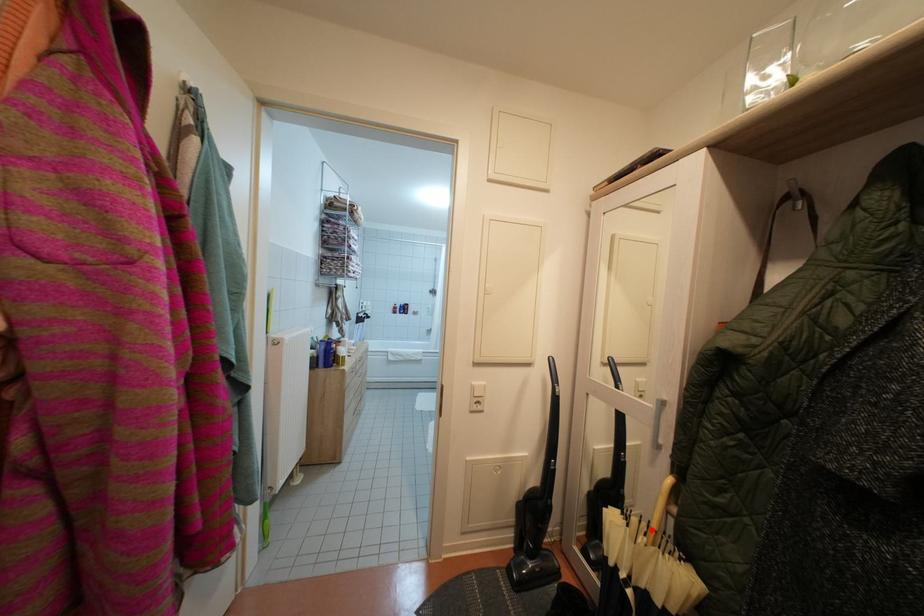
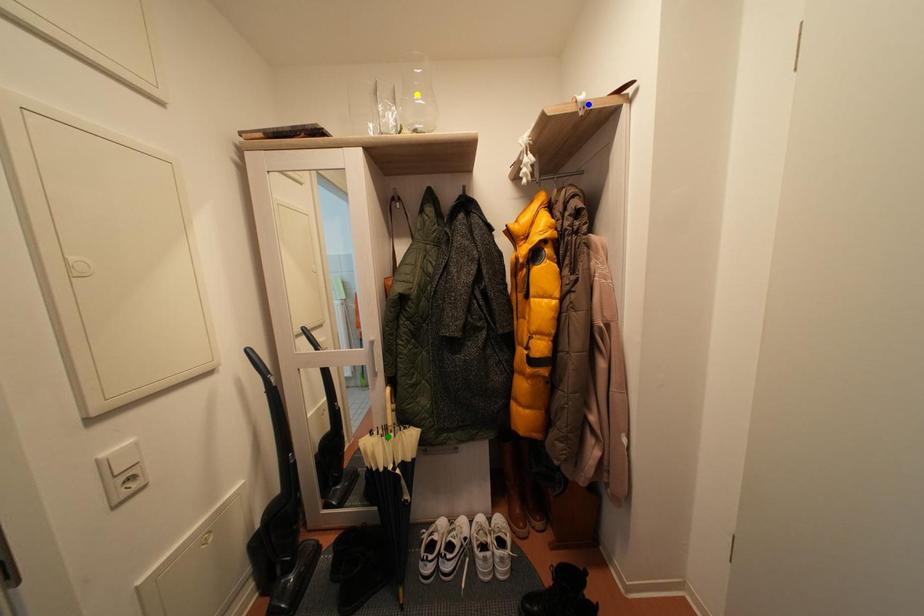
Question: I am providing you with two images of the same scene from different viewpoints. A red point is marked on the first image. You are given multiple points on the second image. Which point in image 2 is actually the same real-world point as the red point in image 1?

Choices:
 (A) blue point
 (B) yellow point
 (C) green point

Answer: (C)